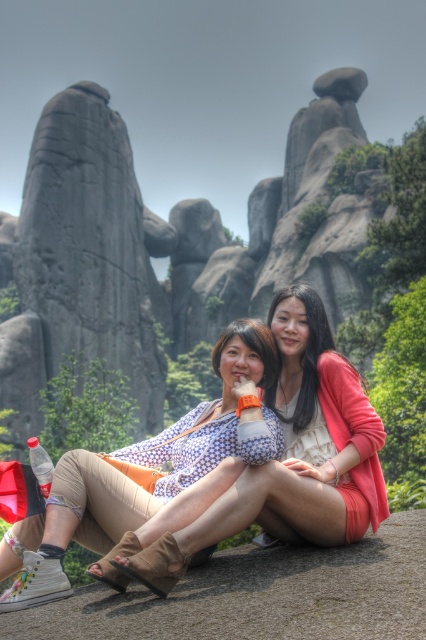
Question: Can you confirm if smooth gray rock at left is wider than matte orange shorts at center?

Choices:
 (A) yes
 (B) no

Answer: (A)

Question: Can you confirm if matte orange shorts at center is positioned to the right of matte floral blouse at center?

Choices:
 (A) yes
 (B) no

Answer: (A)

Question: Which of the following is the farthest from the observer?

Choices:
 (A) matte floral blouse at center
 (B) smooth gray rock at left
 (C) matte orange shorts at center

Answer: (B)

Question: Which point is closer to the camera taking this photo?

Choices:
 (A) (71, 298)
 (B) (299, 381)

Answer: (B)

Question: Which of these objects is positioned farthest from the smooth gray rock at left?

Choices:
 (A) brown leather shoe at lower center
 (B) matte orange shorts at center

Answer: (A)

Question: Does smooth gray rock at left appear over brown leather shoe at lower center?

Choices:
 (A) yes
 (B) no

Answer: (A)